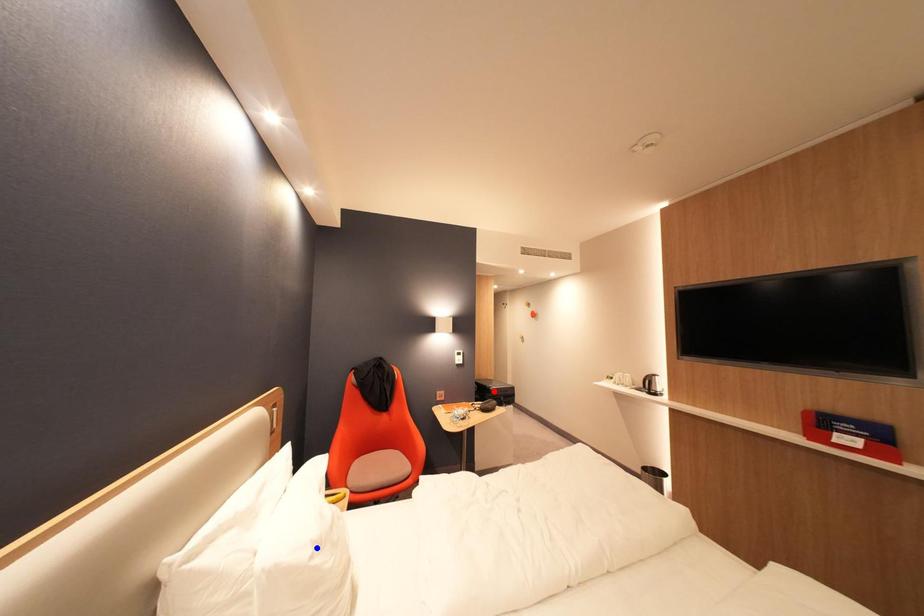
Question: In the image, two points are highlighted. Which point is nearer to the camera? Reply with the corresponding letter.

Choices:
 (A) blue point
 (B) red point

Answer: (A)